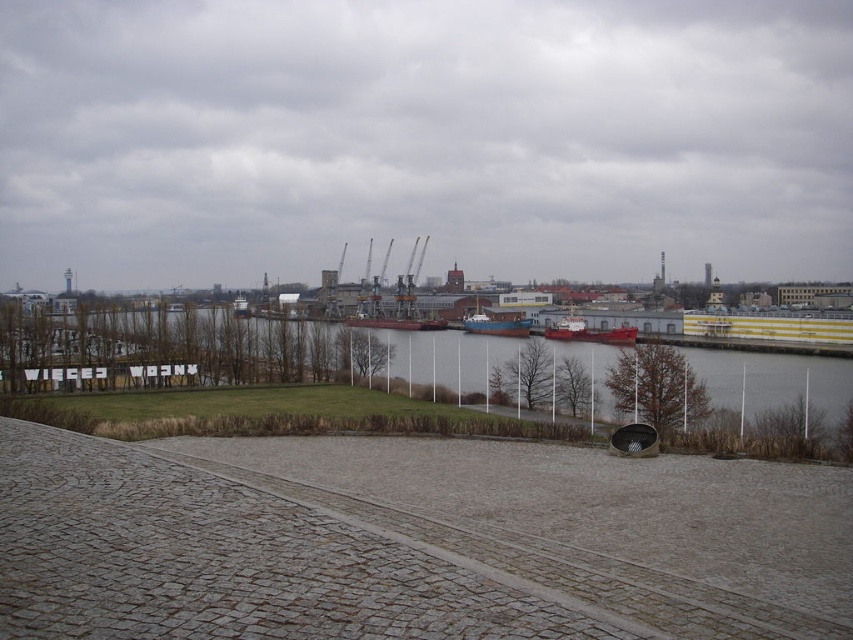
Can you confirm if gray concrete river at center is positioned above blue matte boat at center?

No.

Consider the image. Which is below, gray concrete river at center or blue matte boat at center?

gray concrete river at center

Which is in front, point (361, 413) or point (476, 316)?

Point (361, 413)

You are a GUI agent. You are given a task and a screenshot of the screen. Output one action in this format:
    pyautogui.click(x=<x>, y=<y>)
    Task: Click on the gray concrete river at center
    
    Given the screenshot: What is the action you would take?
    pyautogui.click(x=425, y=384)

Is the position of gray concrete river at center less distant than that of red matte ship at center?

Yes, it is.

Can you confirm if gray concrete river at center is positioned above red matte ship at center?

No.

Who is more forward, (560, 342) or (581, 333)?

Point (560, 342) is in front.

This screenshot has width=853, height=640. I want to click on gray concrete river at center, so coord(425,384).

Which of these two, red matte ship at center or blue matte boat at center, stands taller?

blue matte boat at center is taller.

Is point (579, 323) behind point (469, 330)?

No, (579, 323) is in front of (469, 330).

Image resolution: width=853 pixels, height=640 pixels. In order to click on red matte ship at center in this screenshot , I will do `click(589, 332)`.